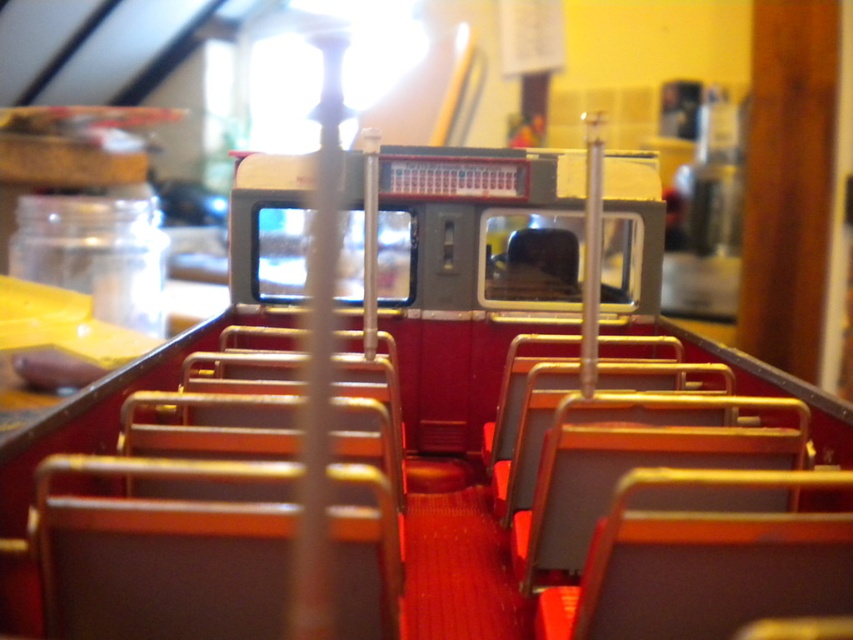
Question: Is brown leather seat at center above metallic red chair at center?

Choices:
 (A) no
 (B) yes

Answer: (A)

Question: Based on their relative distances, which object is farther from the metallic red chair at center?

Choices:
 (A) metallic gold chair at center
 (B) brown leather seat at center
 (C) metallic gray seat at center

Answer: (A)

Question: Which is nearer to the brown leather seat at center?

Choices:
 (A) matte brown chair at center
 (B) metallic gray seat at center

Answer: (B)

Question: Is brown leather chair at center thinner than metallic red chair at center?

Choices:
 (A) no
 (B) yes

Answer: (B)

Question: Is brown leather seat at center further to camera compared to metallic red chair at center?

Choices:
 (A) no
 (B) yes

Answer: (A)

Question: Which point is farther to the camera?

Choices:
 (A) (352, 552)
 (B) (747, 397)
 (C) (503, 497)

Answer: (C)